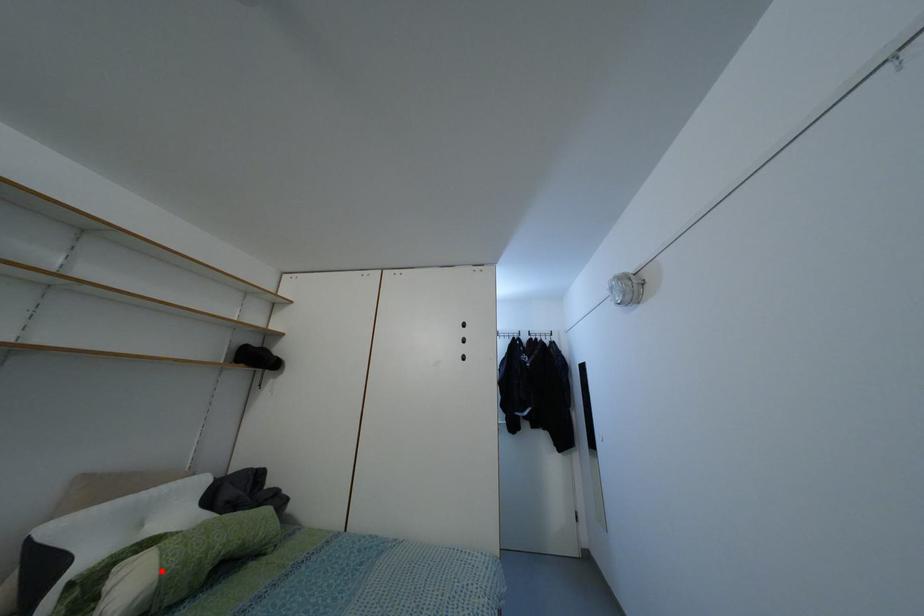
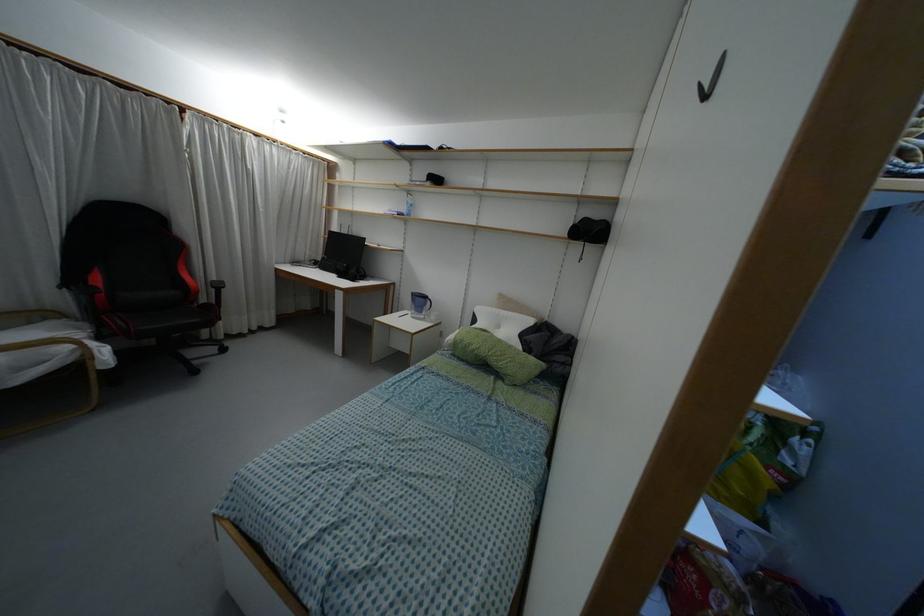
The point at the highlighted location is marked in the first image. Where is the corresponding point in the second image?

(455, 337)